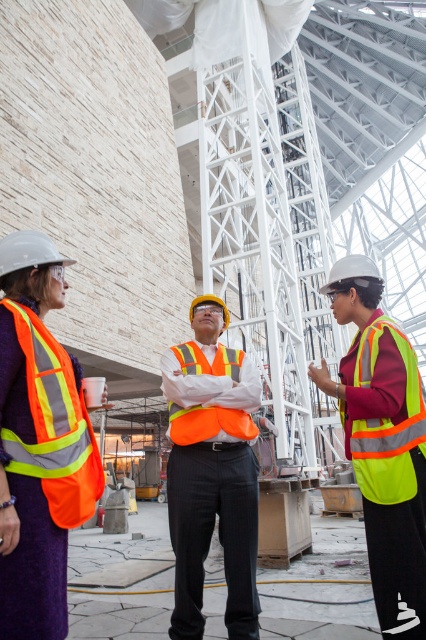
Does high-visibility fabric safety vest at center-right have a lesser width compared to high-visibility orange safety vest at center?

Indeed, high-visibility fabric safety vest at center-right has a lesser width compared to high-visibility orange safety vest at center.

Is high-visibility fabric safety vest at center-right to the left of high-visibility orange safety vest at center from the viewer's perspective?

In fact, high-visibility fabric safety vest at center-right is to the right of high-visibility orange safety vest at center.

Is point (408, 376) positioned after point (184, 412)?

No, (408, 376) is closer to viewer.

Identify the location of high-visibility fabric safety vest at center-right. (386, 422).

Does orange reflective vest at left have a greater width compared to orange reflective vest at center?

Correct, the width of orange reflective vest at left exceeds that of orange reflective vest at center.

Is orange reflective vest at left bigger than orange reflective vest at center?

Yes, orange reflective vest at left is bigger than orange reflective vest at center.

This screenshot has height=640, width=426. Describe the element at coordinates (39, 442) in the screenshot. I see `orange reflective vest at left` at that location.

You are a GUI agent. You are given a task and a screenshot of the screen. Output one action in this format:
    pyautogui.click(x=<x>, y=<y>)
    Task: Click on the orange reflective vest at left
    The width and height of the screenshot is (426, 640).
    Given the screenshot: What is the action you would take?
    (x=39, y=442)

Between orange reflective vest at center and high-visibility orange safety vest at center, which one appears on the right side from the viewer's perspective?

orange reflective vest at center

Can you confirm if orange reflective vest at center is positioned below high-visibility orange safety vest at center?

Yes.

Find the location of a particular element. The height and width of the screenshot is (640, 426). orange reflective vest at center is located at coordinates (212, 470).